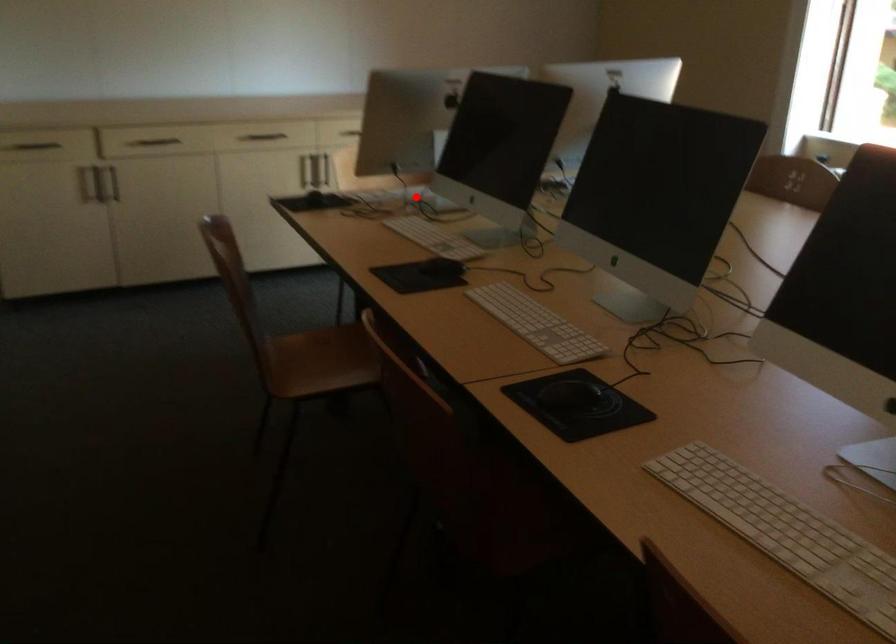
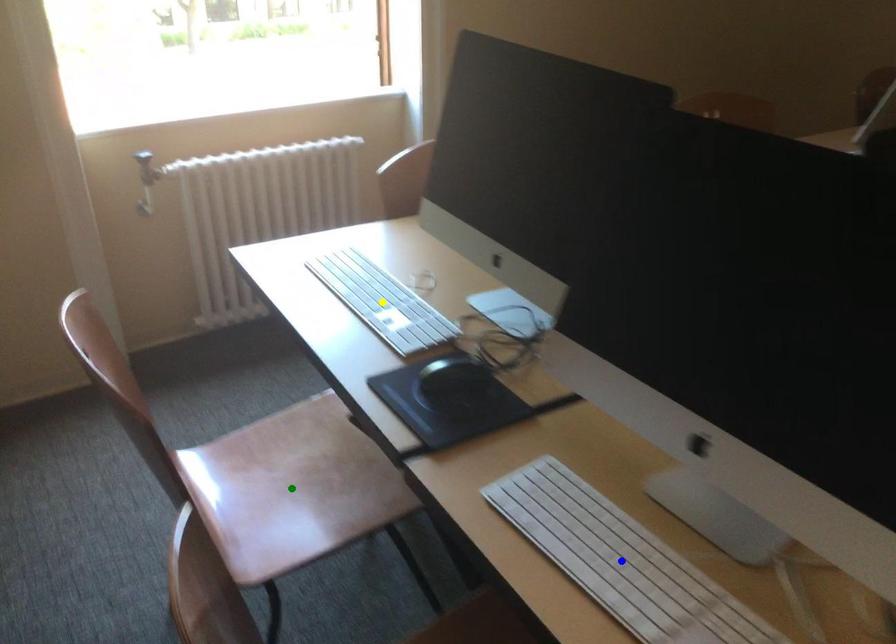
Question: I am providing you with two images of the same scene from different viewpoints. A red point is marked on the first image. You are given multiple points on the second image. Which spot in image 2 lines up with the point in image 1?

Choices:
 (A) blue point
 (B) green point
 (C) yellow point

Answer: (A)